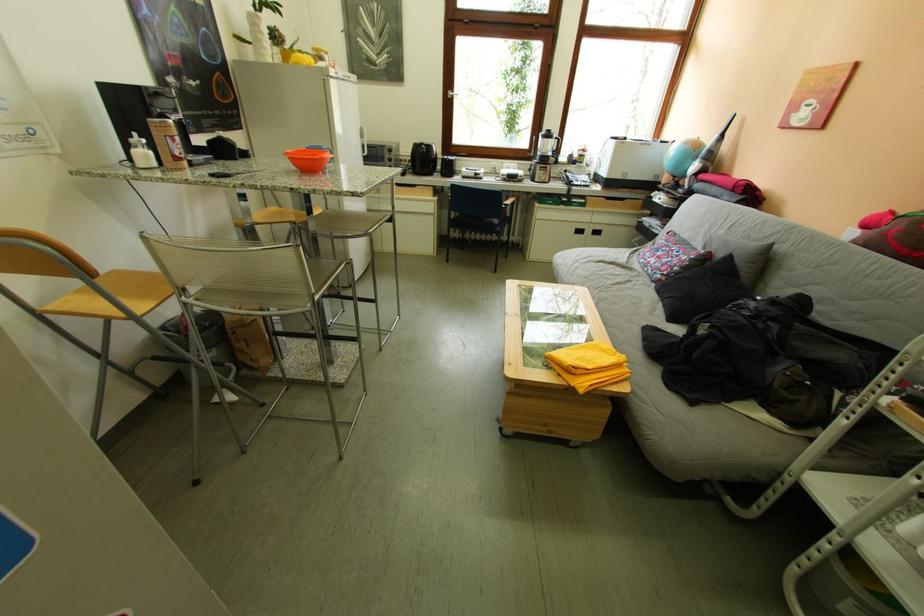
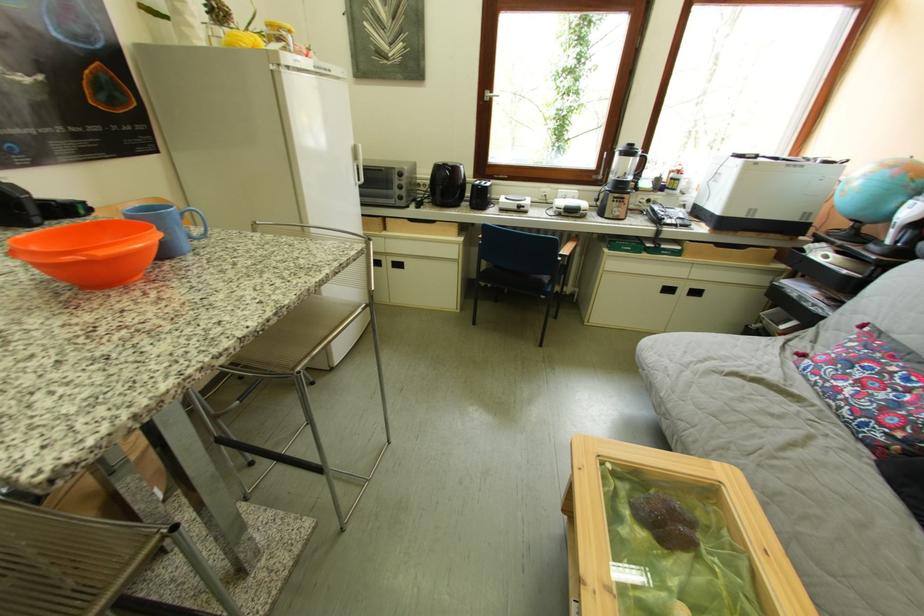
Question: What movement of the cameraman would produce the second image?

Choices:
 (A) Left
 (B) Right
 (C) Forward
 (D) Backward

Answer: (C)